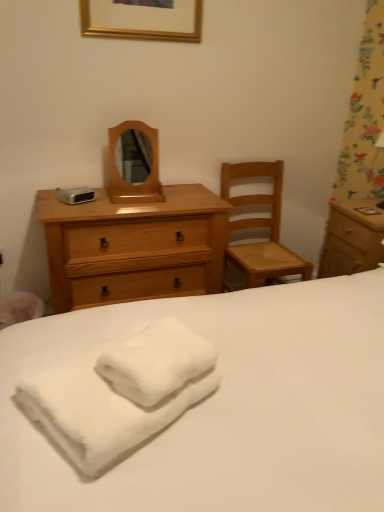
Question: From a real-world perspective, is wooden chair at right beneath gold wooden picture frame at upper center?

Choices:
 (A) no
 (B) yes

Answer: (B)

Question: Considering the relative positions of wooden chair at right and gold wooden picture frame at upper center in the image provided, is wooden chair at right to the left of gold wooden picture frame at upper center from the viewer's perspective?

Choices:
 (A) yes
 (B) no

Answer: (B)

Question: Is wooden chair at right facing away from gold wooden picture frame at upper center?

Choices:
 (A) yes
 (B) no

Answer: (B)

Question: Does wooden chair at right turn towards gold wooden picture frame at upper center?

Choices:
 (A) no
 (B) yes

Answer: (A)

Question: Does wooden chair at right have a greater height compared to gold wooden picture frame at upper center?

Choices:
 (A) yes
 (B) no

Answer: (A)

Question: Is wooden chair at right in front of gold wooden picture frame at upper center?

Choices:
 (A) no
 (B) yes

Answer: (A)

Question: Is white fluffy bath towel at lower left not near white soft towel at center?

Choices:
 (A) no
 (B) yes

Answer: (A)

Question: Is white fluffy bath towel at lower left placed right next to white soft towel at center?

Choices:
 (A) no
 (B) yes

Answer: (A)

Question: Considering the relative positions of white fluffy bath towel at lower left and white soft towel at center in the image provided, is white fluffy bath towel at lower left to the left of white soft towel at center from the viewer's perspective?

Choices:
 (A) no
 (B) yes

Answer: (B)

Question: Considering the relative sizes of white fluffy bath towel at lower left and white soft towel at center in the image provided, is white fluffy bath towel at lower left smaller than white soft towel at center?

Choices:
 (A) yes
 (B) no

Answer: (A)

Question: Does white fluffy bath towel at lower left come behind white soft towel at center?

Choices:
 (A) yes
 (B) no

Answer: (A)

Question: From the image's perspective, is white fluffy bath towel at lower left over white soft towel at center?

Choices:
 (A) yes
 (B) no

Answer: (A)

Question: From a real-world perspective, is light brown wooden chest of drawers at center-left on wooden mirror at center?

Choices:
 (A) yes
 (B) no

Answer: (B)